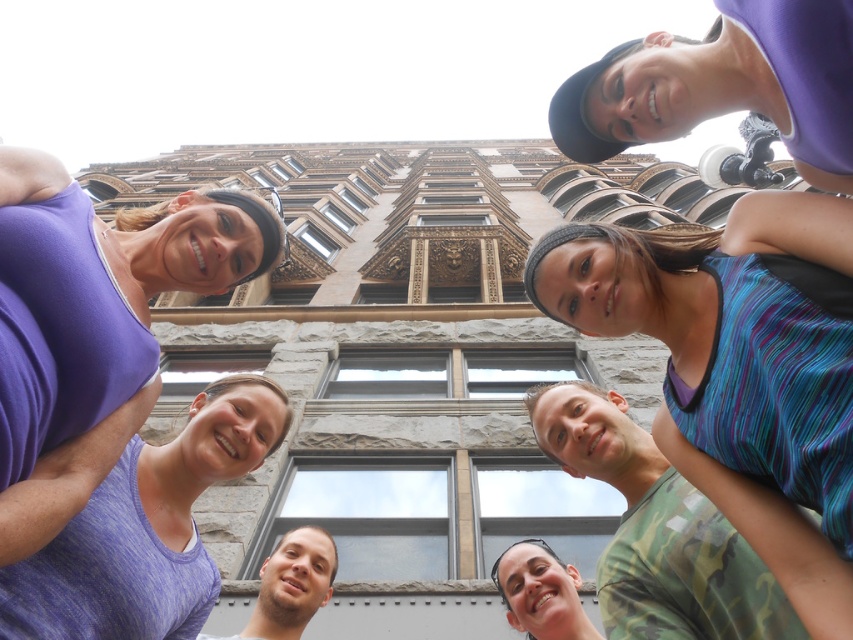
Does point (691, 316) come in front of point (543, 636)?

That is True.

Who is taller, striped fabric tank top at center or matte black hair at lower center?

striped fabric tank top at center is taller.

Who is more distant from viewer, [743,401] or [582,618]?

Positioned behind is point [582,618].

Find the location of a particular element. striped fabric tank top at center is located at coordinates (732, 332).

Does purple heather tank top at upper left appear on the left side of matte green shirt at center?

Correct, you'll find purple heather tank top at upper left to the left of matte green shirt at center.

Does purple heather tank top at upper left have a lesser height compared to matte green shirt at center?

Incorrect, purple heather tank top at upper left's height does not fall short of matte green shirt at center's.

Describe the element at coordinates (146, 529) in the screenshot. This screenshot has height=640, width=853. I see `purple heather tank top at upper left` at that location.

The height and width of the screenshot is (640, 853). I want to click on purple heather tank top at upper left, so click(146, 529).

Describe the element at coordinates (732, 332) in the screenshot. The height and width of the screenshot is (640, 853). I see `striped fabric tank top at center` at that location.

Locate an element on the screen. Image resolution: width=853 pixels, height=640 pixels. striped fabric tank top at center is located at coordinates (732, 332).